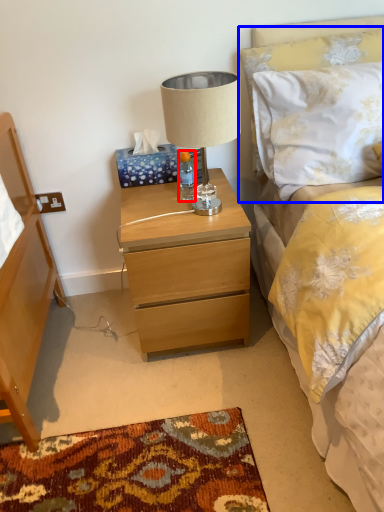
Question: Which object appears farthest to the camera in this image, bottle (highlighted by a red box) or pillow (highlighted by a blue box)?

Choices:
 (A) bottle
 (B) pillow

Answer: (A)